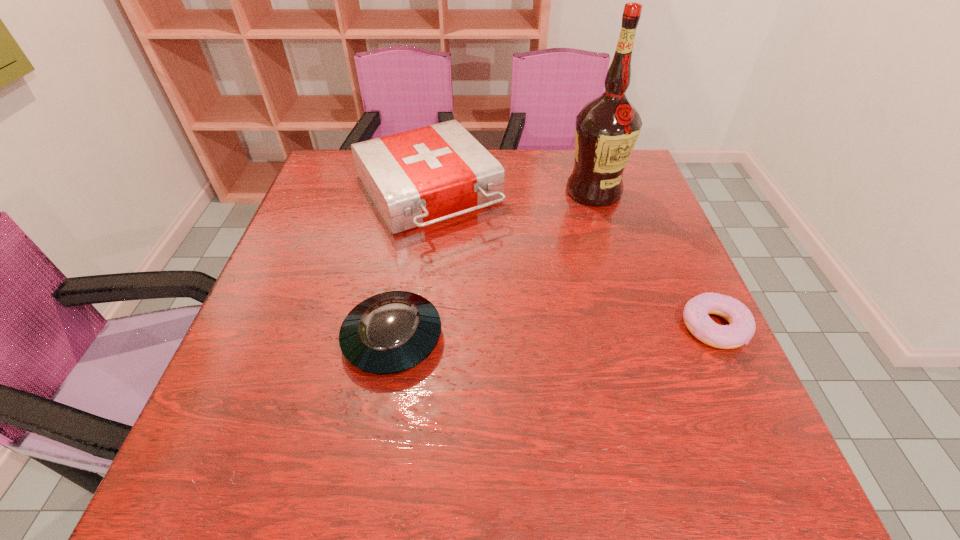
What are the coordinates of `object that is at the far left corner` in the screenshot? It's located at tap(416, 178).

Image resolution: width=960 pixels, height=540 pixels. Identify the location of object present at the far right corner. (606, 130).

Where is `blank area at the far edge`? The height and width of the screenshot is (540, 960). blank area at the far edge is located at coordinates (510, 188).

In the image, there is a desktop. Where is `vacant space at the near edge`? This screenshot has height=540, width=960. vacant space at the near edge is located at coordinates (527, 394).

The width and height of the screenshot is (960, 540). In the image, there is a desktop. Identify the location of vacant space at the left edge. [x=304, y=269].

In the image, there is a desktop. Identify the location of free space at the right edge. The height and width of the screenshot is (540, 960). (649, 311).

In the image, there is a desktop. Identify the location of vacant space at the far left corner. The width and height of the screenshot is (960, 540). [327, 159].

Find the location of `free space at the near right corner of the desktop`. free space at the near right corner of the desktop is located at coordinates (752, 415).

The width and height of the screenshot is (960, 540). What are the coordinates of `free space that is in between the third shortest object and the shortest object` in the screenshot? It's located at (570, 261).

Locate an element on the screen. The image size is (960, 540). vacant space that is in between the third shortest object and the tallest object is located at coordinates (511, 193).